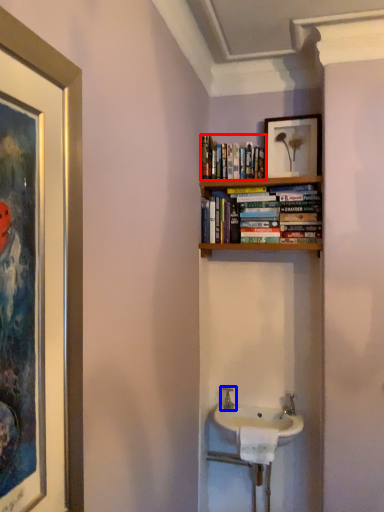
Question: Which object appears farthest to the camera in this image, book (highlighted by a red box) or tap (highlighted by a blue box)?

Choices:
 (A) book
 (B) tap

Answer: (B)